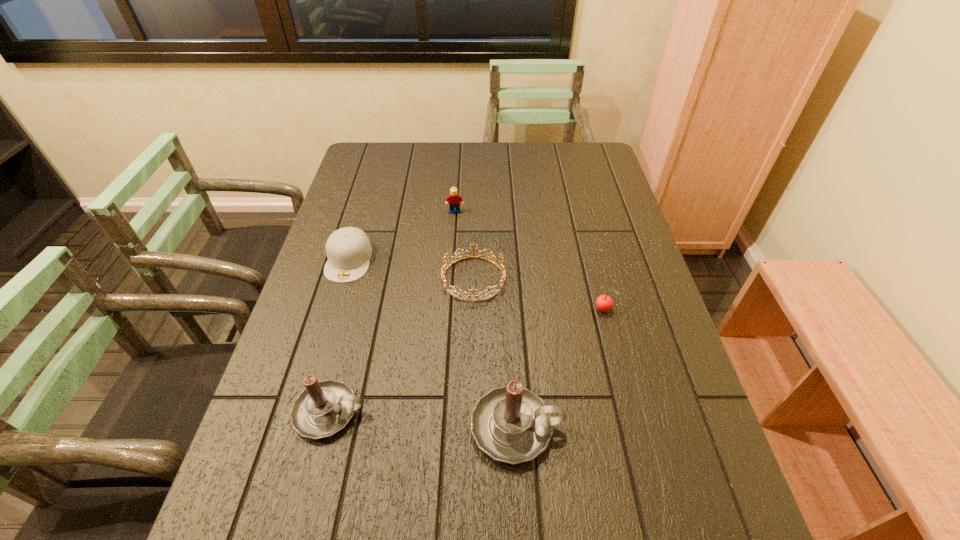
Image resolution: width=960 pixels, height=540 pixels. Find the location of `vacant space located 0.330m on the front-facing side of the farthest object`. vacant space located 0.330m on the front-facing side of the farthest object is located at coordinates coord(450,290).

This screenshot has height=540, width=960. Find the location of `blank space located 0.400m on the front-facing side of the cap`. blank space located 0.400m on the front-facing side of the cap is located at coordinates (300, 423).

Find the location of a particular element. free space located on the front of the rightmost object is located at coordinates (630, 420).

Where is `free space located 0.110m on the front-facing side of the shortest object`? The image size is (960, 540). free space located 0.110m on the front-facing side of the shortest object is located at coordinates (472, 339).

Locate an element on the screen. object located in the near edge section of the desktop is located at coordinates (511, 424).

You are a GUI agent. You are given a task and a screenshot of the screen. Output one action in this format:
    pyautogui.click(x=<x>, y=<y>)
    Task: Click on the candle that is at the left edge
    This screenshot has width=960, height=540.
    Given the screenshot: What is the action you would take?
    pyautogui.click(x=324, y=408)

The image size is (960, 540). Identify the location of cap that is at the left edge. (348, 249).

You are a GUI agent. You are given a task and a screenshot of the screen. Output one action in this format:
    pyautogui.click(x=<x>, y=<y>)
    Task: Click on the object at the right edge
    The width and height of the screenshot is (960, 540).
    Given the screenshot: What is the action you would take?
    pyautogui.click(x=604, y=303)

Identify the location of free location at the far edge. Image resolution: width=960 pixels, height=540 pixels. (529, 166).

The width and height of the screenshot is (960, 540). In order to click on free space at the near edge in this screenshot , I will do `click(612, 449)`.